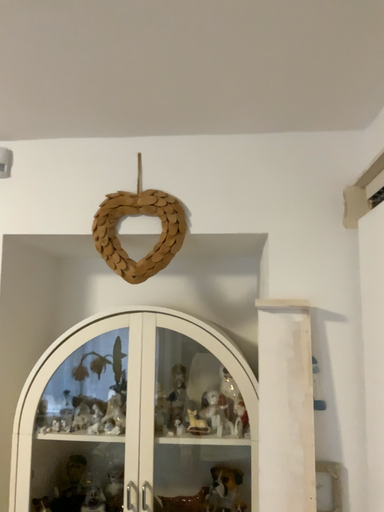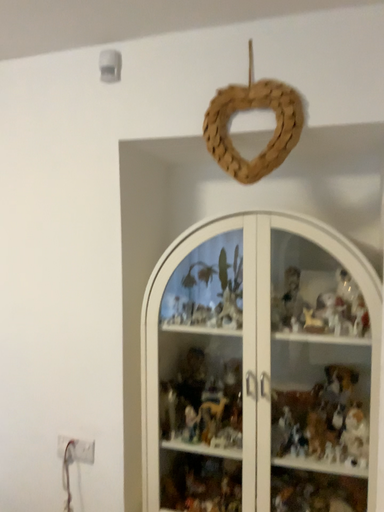
Question: Which way did the camera rotate in the video?

Choices:
 (A) rotated downward
 (B) rotated upward

Answer: (A)